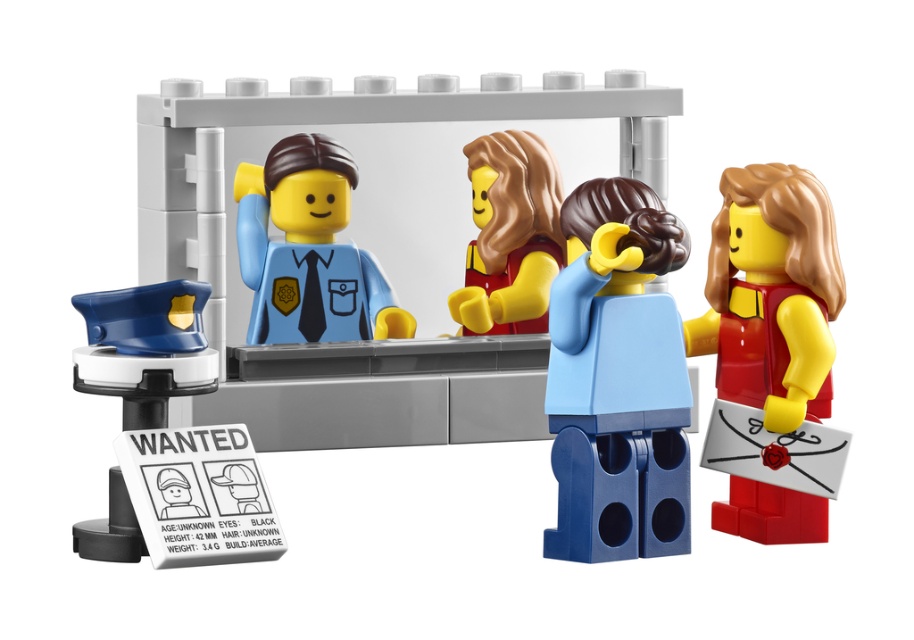
You are a LEGO figure trying to reach the smooth red dress at right and the smooth black cap at upper left. Which object is closer to you?

The smooth red dress at right is closer to you because it is further to the viewer than the smooth black cap at upper left.

You are a LEGO enthusiast trying to recreate the police station scene. You have two LEGO pieces labeled matte blue uniform at center and smooth brown hair at center. According to the scene, how far apart should these pieces be placed?

The matte blue uniform at center and smooth brown hair at center should be placed 4.32 inches apart from each other.

You are a LEGO figure trying to decide whether to stand behind the desk or sit on the desk. The desk is narrow. If you choose to sit on the desk, will the matte blue uniform at center and the smooth black cap at upper left both fit on the desk without overlapping?

The matte blue uniform at center is wider than the smooth black cap at upper left, so if the desk is narrow, both might not fit without overlapping. The matte blue uniform at center takes up more space due to its greater width.